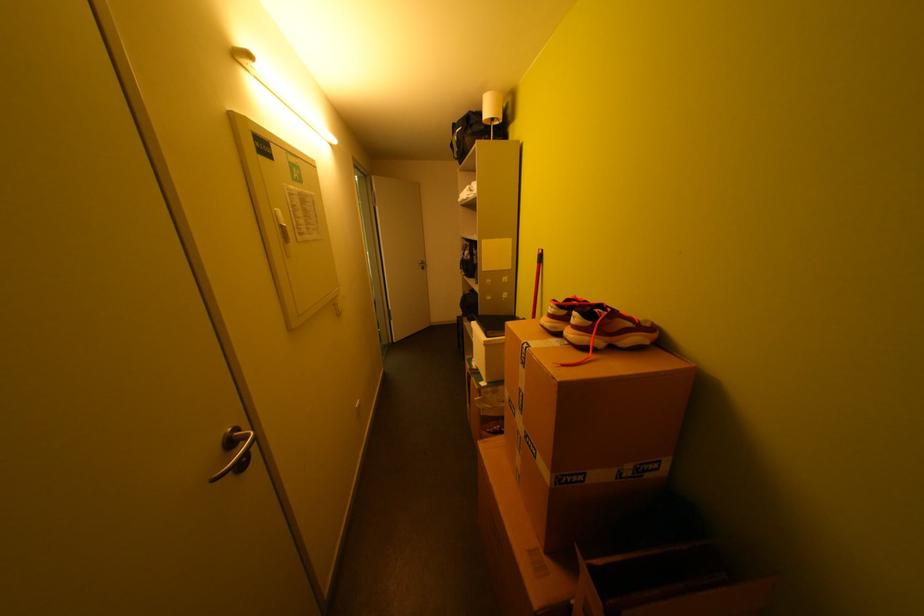
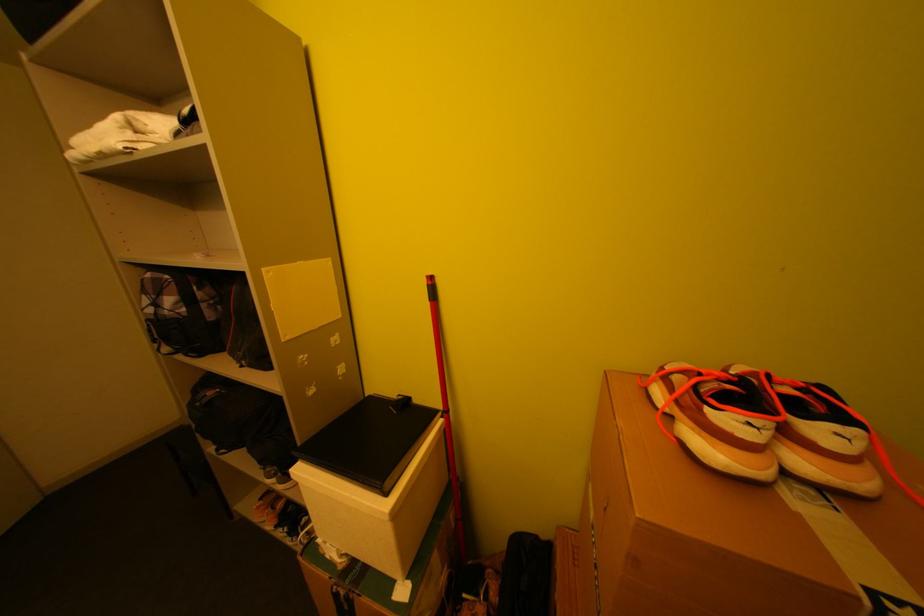
Question: The camera is either moving clockwise (left) or counter-clockwise (right) around the object. The first image is from the beginning of the video and the second image is from the end. Is the camera moving left or right when shooting the video?

Choices:
 (A) Left
 (B) Right

Answer: (A)